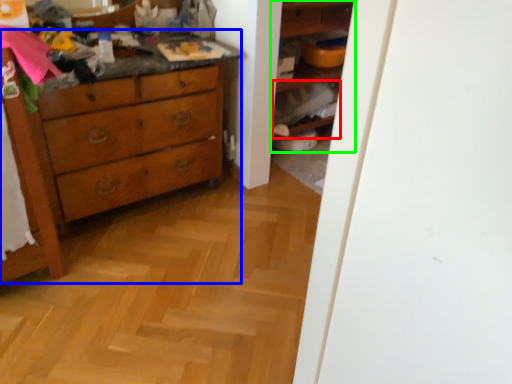
Question: Considering the real-world distances, which object is farthest from cabinet (highlighted by a red box)? chest of drawers (highlighted by a blue box) or shelf (highlighted by a green box)?

Choices:
 (A) chest of drawers
 (B) shelf

Answer: (A)